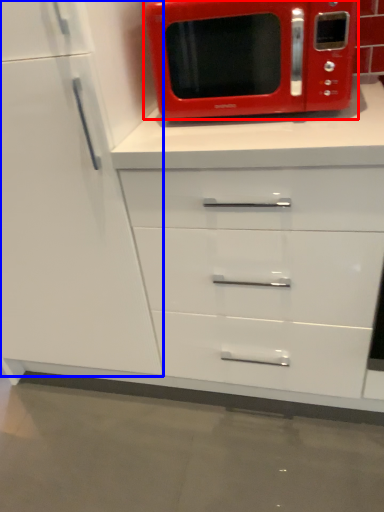
Question: Among these objects, which one is nearest to the camera, microwave oven (highlighted by a red box) or cabinetry (highlighted by a blue box)?

Choices:
 (A) microwave oven
 (B) cabinetry

Answer: (B)